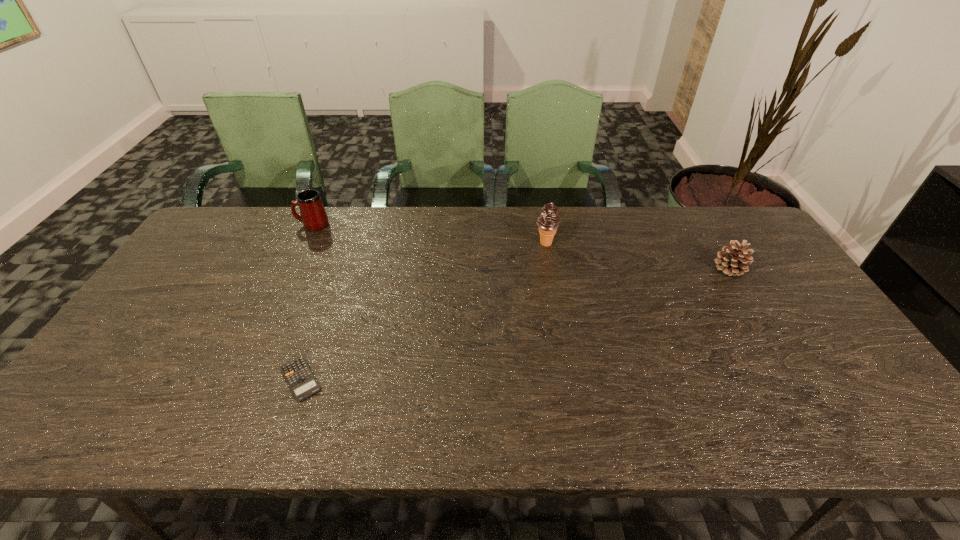
You are a GUI agent. You are given a task and a screenshot of the screen. Output one action in this format:
    pyautogui.click(x=<x>, y=<y>)
    Task: Click on the free space located on the side of the farthest object with the handle
    
    Given the screenshot: What is the action you would take?
    pyautogui.click(x=276, y=225)

This screenshot has width=960, height=540. I want to click on vacant space located on the side of the farthest object with the handle, so click(x=231, y=225).

In order to click on vacant position located 0.370m on the left of the third farthest object in this screenshot , I will do `click(591, 268)`.

I want to click on vacant position located on the right of the second object from left to right, so click(x=429, y=379).

This screenshot has height=540, width=960. In order to click on icecream located at the far edge in this screenshot , I will do `click(548, 221)`.

Identify the location of mug that is at the far edge. This screenshot has width=960, height=540. (313, 216).

Locate an element on the screen. This screenshot has height=540, width=960. object that is at the right edge is located at coordinates (731, 261).

Find the location of `blank area at the far edge`. blank area at the far edge is located at coordinates (533, 217).

Identify the location of free space at the near edge. Image resolution: width=960 pixels, height=540 pixels. (732, 438).

Locate an element on the screen. This screenshot has width=960, height=540. free space at the left edge is located at coordinates (185, 338).